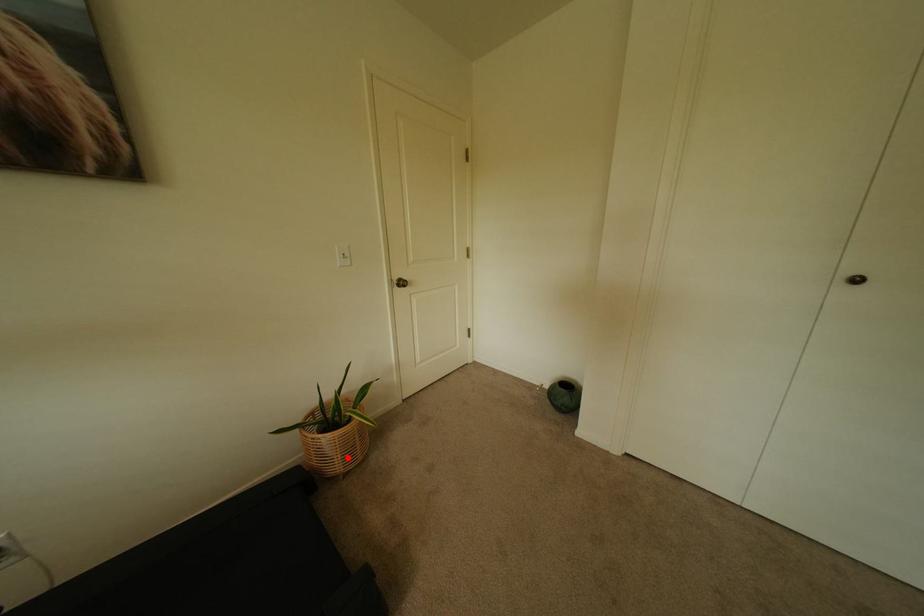
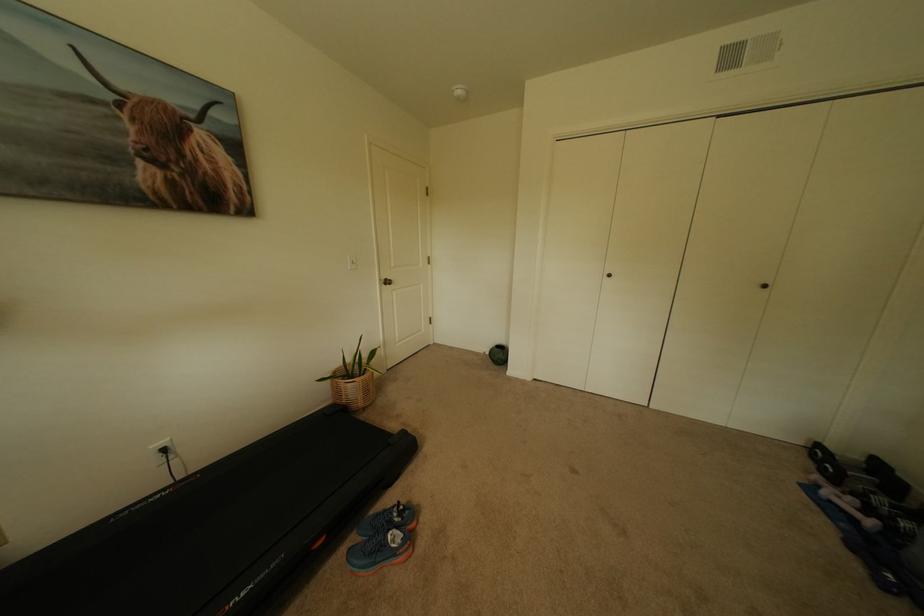
Question: I am providing you with two images of the same scene from different viewpoints. A red point is marked on the first image. Is the red point's position out of view in image 2?

Choices:
 (A) Yes
 (B) No

Answer: (B)